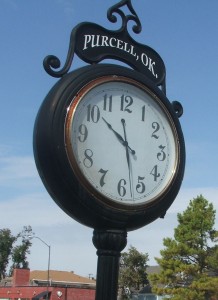
You are a GUI agent. You are given a task and a screenshot of the screen. Output one action in this format:
    pyautogui.click(x=<x>, y=<y>)
    Task: Click on the chimney
    This screenshot has width=218, height=300.
    Given the screenshot: What is the action you would take?
    pyautogui.click(x=21, y=276)